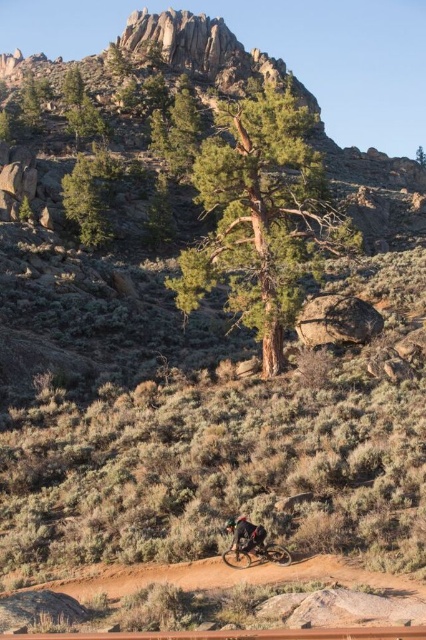
Is point (209, 268) farther from camera compared to point (187, 45)?

No.

Can you confirm if green textured tree at center is positioned below rugged granite mountain at upper center?

Correct, green textured tree at center is located below rugged granite mountain at upper center.

The height and width of the screenshot is (640, 426). Describe the element at coordinates (262, 216) in the screenshot. I see `green textured tree at center` at that location.

This screenshot has width=426, height=640. Find the location of `green textured tree at center`. green textured tree at center is located at coordinates (262, 216).

Based on the photo, is green textured tree at center bigger than green matte tree at upper left?

Indeed, green textured tree at center has a larger size compared to green matte tree at upper left.

Who is positioned more to the right, green textured tree at center or green matte tree at upper left?

green textured tree at center is more to the right.

You are a GUI agent. You are given a task and a screenshot of the screen. Output one action in this format:
    pyautogui.click(x=<x>, y=<y>)
    Task: Click on the green textured tree at center
    Image resolution: width=426 pixels, height=640 pixels.
    Given the screenshot: What is the action you would take?
    pyautogui.click(x=262, y=216)

The height and width of the screenshot is (640, 426). What do you see at coordinates (224, 577) in the screenshot? I see `brown dirt track at lower center` at bounding box center [224, 577].

Between point (308, 563) and point (66, 209), which one is positioned behind?

The point (66, 209) is more distant.

Does point (270, 580) come farther from viewer compared to point (100, 182)?

That is False.

Locate an element on the screen. The height and width of the screenshot is (640, 426). brown dirt track at lower center is located at coordinates (224, 577).